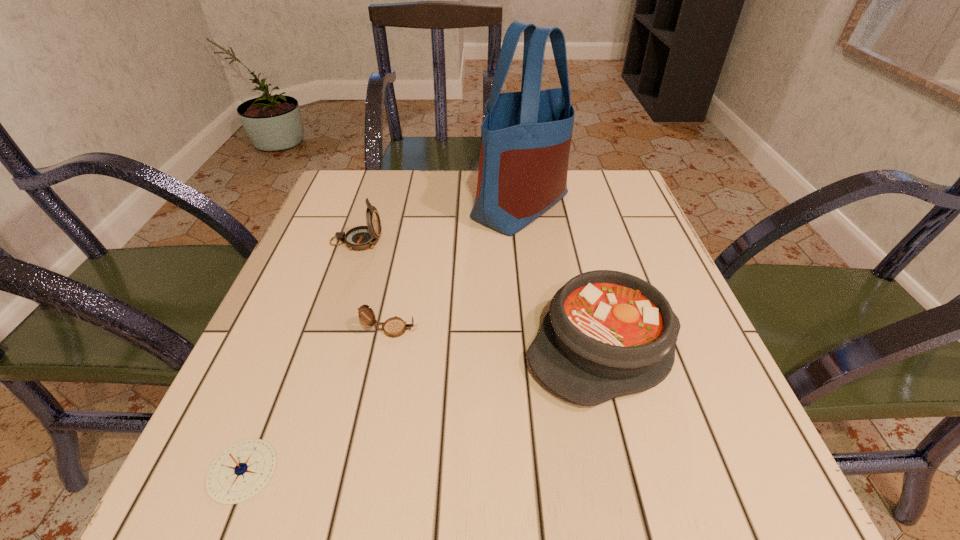
You are a GUI agent. You are given a task and a screenshot of the screen. Output one action in this format:
    pyautogui.click(x=<x>, y=<y>)
    Task: Click on the free space located on the right of the nearest object
    
    Given the screenshot: What is the action you would take?
    pyautogui.click(x=372, y=471)

Where is `object that is at the far edge`? object that is at the far edge is located at coordinates (526, 136).

Locate an element on the screen. The width and height of the screenshot is (960, 540). object that is at the near edge is located at coordinates (241, 471).

Where is `handbag that is at the right edge`? handbag that is at the right edge is located at coordinates (526, 136).

Where is `casserole that is positioned at the right edge`? The width and height of the screenshot is (960, 540). casserole that is positioned at the right edge is located at coordinates (607, 334).

The image size is (960, 540). Identify the location of object at the near left corner. (241, 471).

At what (x,y) coordinates should I click in order to perform the action: click on object that is positioned at the far right corner. Please return your answer as a coordinate pair (x, y). Looking at the image, I should click on (526, 136).

Find the location of `vacant space at the far edge`. vacant space at the far edge is located at coordinates (447, 204).

What are the coordinates of `blank space at the near edge of the desktop` in the screenshot? It's located at (518, 470).

This screenshot has width=960, height=540. I want to click on free region at the left edge of the desktop, so click(303, 273).